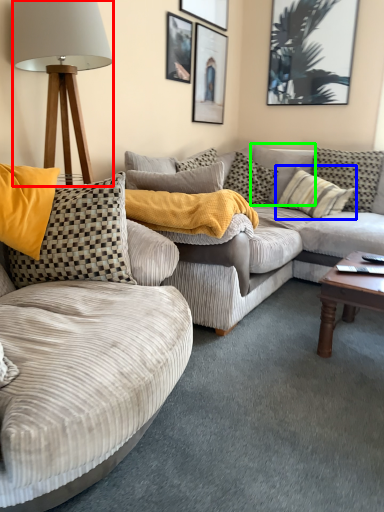
Question: Which object is the closest to the lamp (highlighted by a red box)? Choose among these: pillow (highlighted by a blue box) or pillow (highlighted by a green box).

Choices:
 (A) pillow
 (B) pillow

Answer: (A)